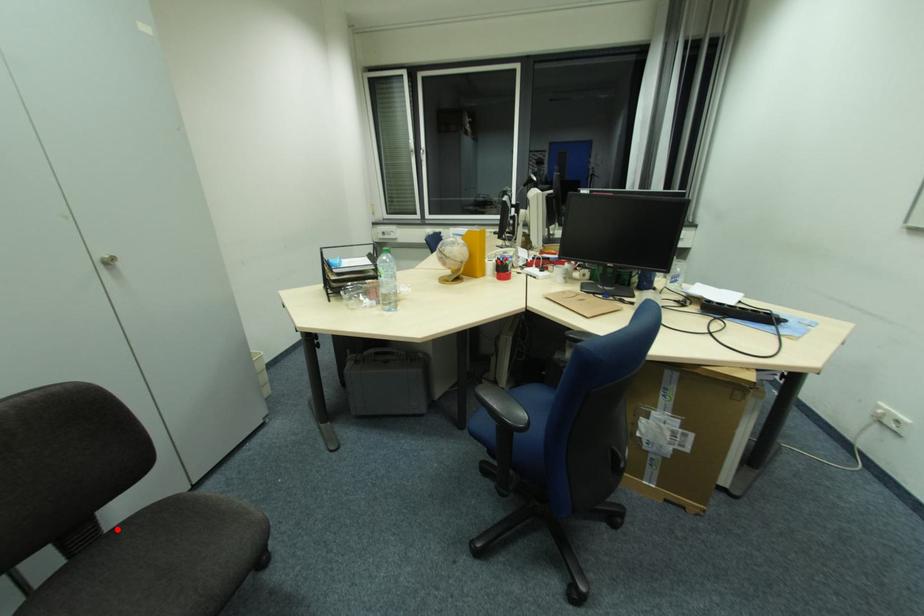
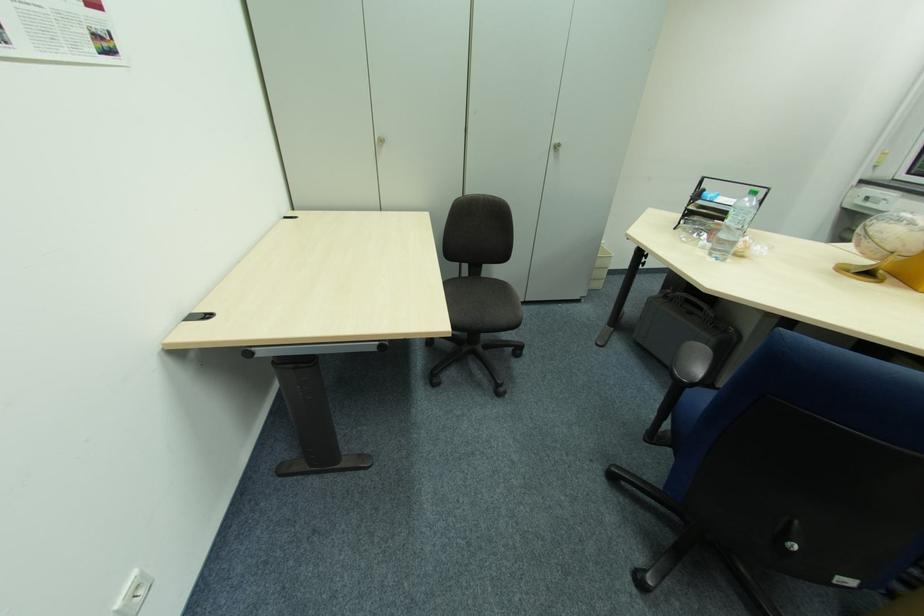
Find the pixel in the second image that matches the highlighted location in the first image.

(485, 278)